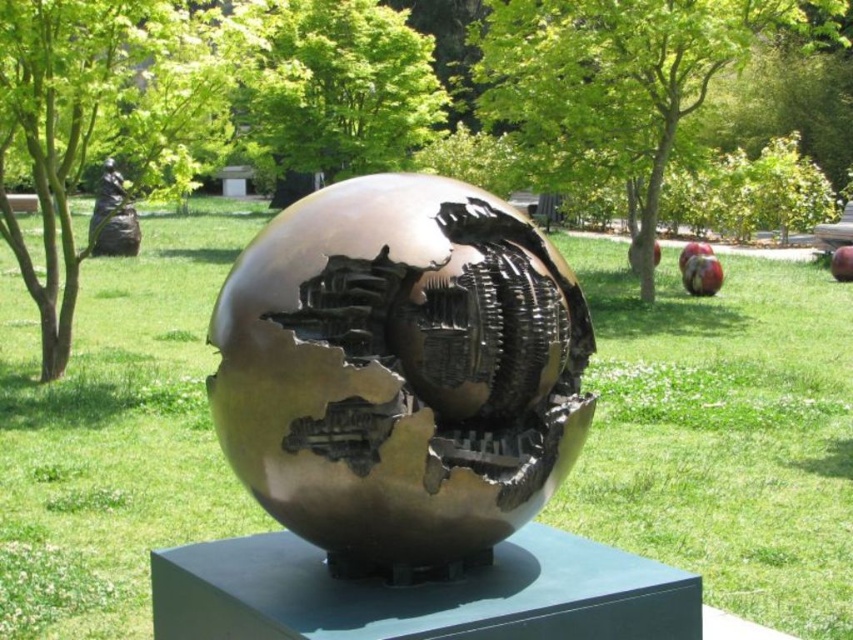
Question: Which object is farther from the camera taking this photo?

Choices:
 (A) black matte statue at upper left
 (B) bronze metallic sphere at center

Answer: (A)

Question: Can you confirm if bronze metallic sphere at center is bigger than black matte statue at upper left?

Choices:
 (A) yes
 (B) no

Answer: (B)

Question: Is bronze metallic sphere at center thinner than black matte statue at upper left?

Choices:
 (A) no
 (B) yes

Answer: (B)

Question: Can you confirm if bronze metallic sphere at center is positioned above black matte statue at upper left?

Choices:
 (A) no
 (B) yes

Answer: (A)